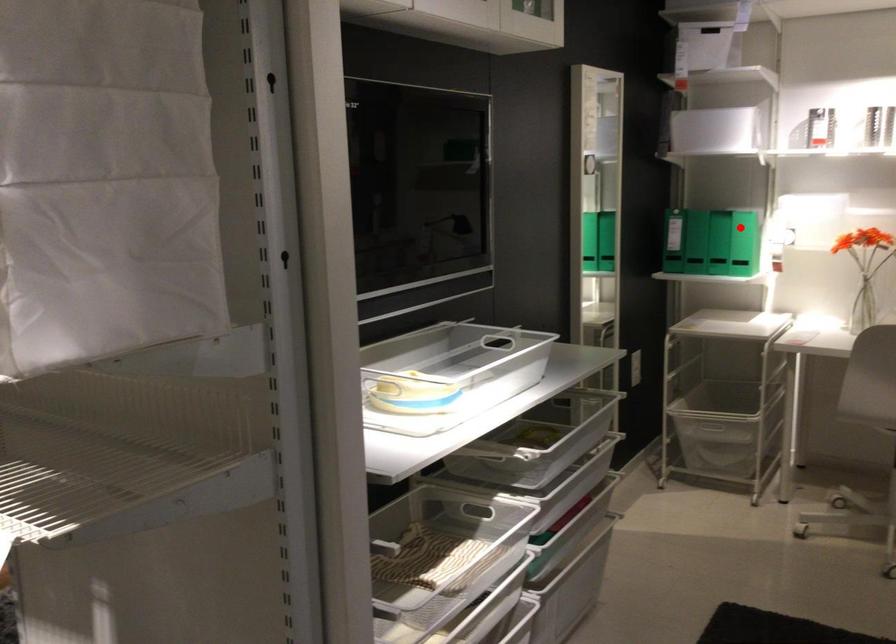
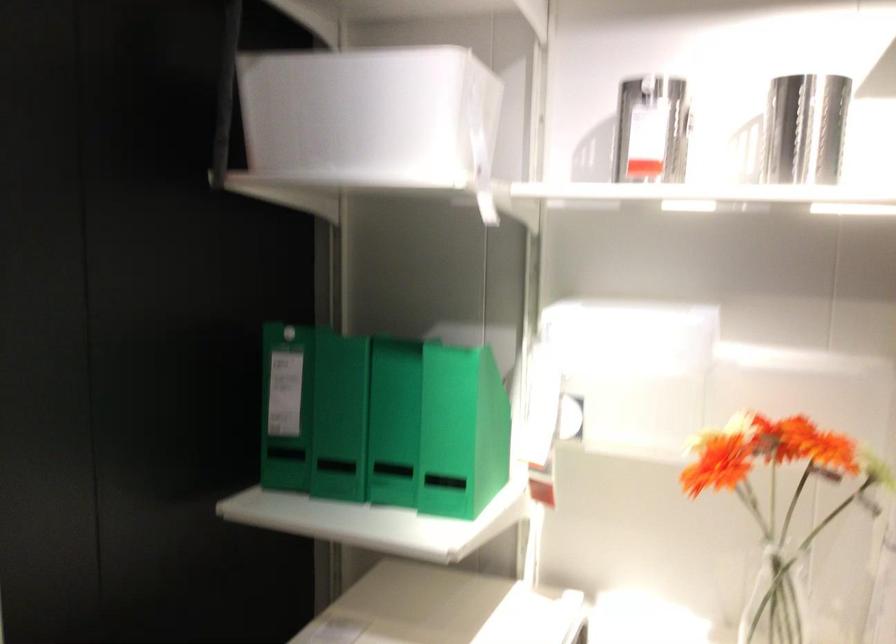
The point at the highlighted location is marked in the first image. Where is the corresponding point in the second image?

(392, 422)